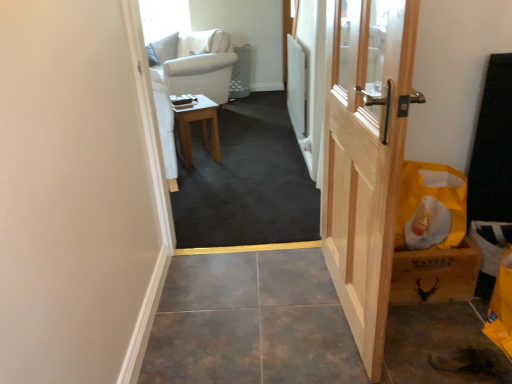
What is the approximate height of wooden table at center?

It is 47.51 centimeters.

The image size is (512, 384). In order to click on wooden table at center in this screenshot , I will do `click(202, 127)`.

The height and width of the screenshot is (384, 512). What are the coordinates of `natural wood door at right` in the screenshot? It's located at (365, 157).

In order to click on wooden table at center in this screenshot , I will do `click(202, 127)`.

Consider the image. Is carpeted floor at center touching yellow paper bag at right?

No, carpeted floor at center is not beside yellow paper bag at right.

How much distance is there between carpeted floor at center and yellow paper bag at right?

carpeted floor at center and yellow paper bag at right are 38.23 inches apart.

Is the depth of carpeted floor at center greater than that of yellow paper bag at right?

Yes.

From a real-world perspective, between carpeted floor at center and yellow paper bag at right, who is vertically lower?

From a 3D spatial view, carpeted floor at center is below.

Would you say yellow paper bag at right contains carpeted floor at center?

No.

Between point (459, 250) and point (275, 100), which one is positioned in front?

Positioned in front is point (459, 250).

Is yellow paper bag at right beside carpeted floor at center?

yellow paper bag at right is not next to carpeted floor at center, and they're not touching.

Consider the image. Considering the relative positions of yellow paper bag at right and carpeted floor at center in the image provided, is yellow paper bag at right to the left of carpeted floor at center from the viewer's perspective?

Incorrect, yellow paper bag at right is not on the left side of carpeted floor at center.

Consider the image. From the image's perspective, relative to wooden table at center, is carpeted floor at center above or below?

Clearly, from the image's perspective, carpeted floor at center is above wooden table at center.

Does carpeted floor at center turn towards wooden table at center?

No.

Considering the sizes of carpeted floor at center and wooden table at center in the image, is carpeted floor at center taller or shorter than wooden table at center?

Clearly, carpeted floor at center is shorter compared to wooden table at center.

Considering the relative sizes of natural wood door at right and wooden table at center in the image provided, is natural wood door at right taller than wooden table at center?

Yes.

Which is behind, point (343, 131) or point (189, 125)?

The point (189, 125) is behind.

Would you say natural wood door at right is a long distance from wooden table at center?

Absolutely, natural wood door at right is distant from wooden table at center.

What's the angular difference between natural wood door at right and wooden table at center's facing directions?

69 degrees separate the facing orientations of natural wood door at right and wooden table at center.

Is yellow paper bag at right smaller than natural wood door at right?

Indeed, yellow paper bag at right has a smaller size compared to natural wood door at right.

At what (x,y) coordinates should I click in order to perform the action: click on cardboard box below the natural wood door at right (from the image's perspective). Please return your answer as a coordinate pair (x, y). The height and width of the screenshot is (384, 512). Looking at the image, I should click on (433, 238).

From the picture: Is yellow paper bag at right oriented towards natural wood door at right?

No, yellow paper bag at right does not turn towards natural wood door at right.

From the image's perspective, which one is positioned lower, yellow paper bag at right or natural wood door at right?

yellow paper bag at right appears lower in the image.

Looking at this image, does carpeted floor at center have a greater width compared to natural wood door at right?

Yes.

Is carpeted floor at center inside or outside of natural wood door at right?

carpeted floor at center exists outside the volume of natural wood door at right.

Is carpeted floor at center placed right next to natural wood door at right?

carpeted floor at center and natural wood door at right are clearly separated.

Which is more to the right, yellow paper bag at right or wooden table at center?

Positioned to the right is yellow paper bag at right.

Based on the photo, is yellow paper bag at right not near wooden table at center?

Yes, yellow paper bag at right is far from wooden table at center.

Considering the relative sizes of yellow paper bag at right and wooden table at center in the image provided, is yellow paper bag at right smaller than wooden table at center?

Yes.

Considering the relative sizes of yellow paper bag at right and wooden table at center in the image provided, is yellow paper bag at right thinner than wooden table at center?

Yes.

The image size is (512, 384). What are the coordinates of `cardboard box lying in front of the carpeted floor at center` in the screenshot? It's located at (433, 238).

Find the location of a particular element. corridor located on the left of yellow paper bag at right is located at coordinates (246, 181).

In the scene shown: Which object lies further to the anchor point natural wood door at right, yellow paper bag at right or wooden table at center?

wooden table at center lies further to natural wood door at right than the other object.

Looking at the image, which one is located closer to carpeted floor at center, yellow paper bag at right or natural wood door at right?

Among the two, natural wood door at right is located nearer to carpeted floor at center.

Estimate the real-world distances between objects in this image. Which object is closer to natural wood door at right, carpeted floor at center or wooden table at center?

carpeted floor at center is positioned closer to the anchor natural wood door at right.

Considering their positions, is carpeted floor at center positioned further to wooden table at center than yellow paper bag at right?

yellow paper bag at right.

Based on their spatial positions, is natural wood door at right or carpeted floor at center further from wooden table at center?

natural wood door at right is further to wooden table at center.

Which object lies further to the anchor point yellow paper bag at right, natural wood door at right or wooden table at center?

wooden table at center is further to yellow paper bag at right.

Estimate the real-world distances between objects in this image. Which object is closer to yellow paper bag at right, carpeted floor at center or wooden table at center?

Based on the image, carpeted floor at center appears to be nearer to yellow paper bag at right.

From the image, which object appears to be nearer to natural wood door at right, wooden table at center or yellow paper bag at right?

yellow paper bag at right is closer to natural wood door at right.

Find the location of `cardboard box between natural wood door at right and carpeted floor at center in the front-back direction`. cardboard box between natural wood door at right and carpeted floor at center in the front-back direction is located at coordinates (433, 238).

Find the location of a particular element. The height and width of the screenshot is (384, 512). corridor positioned between natural wood door at right and wooden table at center from near to far is located at coordinates (246, 181).

Where is `cardboard box between natural wood door at right and wooden table at center in the front-back direction`? The height and width of the screenshot is (384, 512). cardboard box between natural wood door at right and wooden table at center in the front-back direction is located at coordinates (433, 238).

Find the location of a particular element. corridor between yellow paper bag at right and wooden table at center from front to back is located at coordinates (246, 181).